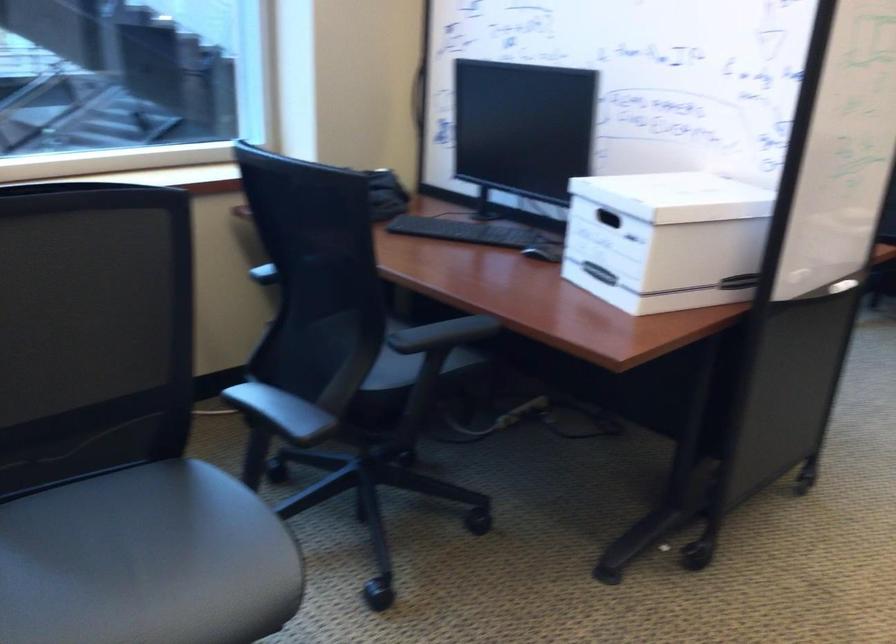
Find where to typ the black computer keyboard. Please return your answer as a coordinate pair (x, y).

(467, 231)